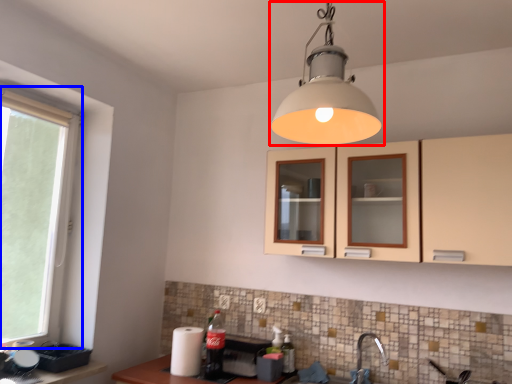
Question: Which object is closer to the camera taking this photo, lamp (highlighted by a red box) or window (highlighted by a blue box)?

Choices:
 (A) lamp
 (B) window

Answer: (A)